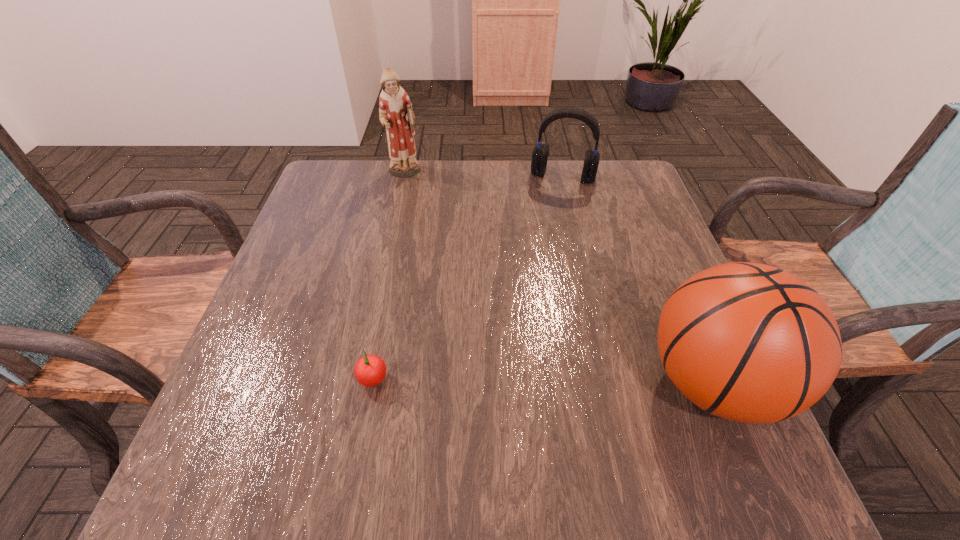
Locate an element on the screen. This screenshot has width=960, height=540. vacant space in between the figurine and the basketball is located at coordinates (559, 278).

This screenshot has width=960, height=540. What are the coordinates of `vacant area that lies between the headset and the cherry` in the screenshot? It's located at 468,280.

Identify the location of empty space between the cherry and the basketball. (542, 383).

Image resolution: width=960 pixels, height=540 pixels. I want to click on free area in between the shortest object and the basketball, so click(x=542, y=383).

Locate an element on the screen. unoccupied area between the cherry and the figurine is located at coordinates (389, 278).

The image size is (960, 540). I want to click on vacant region between the third tallest object and the shortest object, so click(x=468, y=280).

The image size is (960, 540). Identify the location of object that stands as the second closest to the headset. (748, 342).

The width and height of the screenshot is (960, 540). What are the coordinates of `object that ranks as the third closest to the third tallest object` in the screenshot? It's located at (370, 370).

Where is `vacant point that satisfies the following two spatial constraints: 1. on the back side of the shortest object; 2. on the right side of the headset`? The image size is (960, 540). vacant point that satisfies the following two spatial constraints: 1. on the back side of the shortest object; 2. on the right side of the headset is located at coordinates point(412,176).

Where is `blank space that satisfies the following two spatial constraints: 1. on the back side of the headset; 2. on the left side of the shortest object`? blank space that satisfies the following two spatial constraints: 1. on the back side of the headset; 2. on the left side of the shortest object is located at coordinates (412, 176).